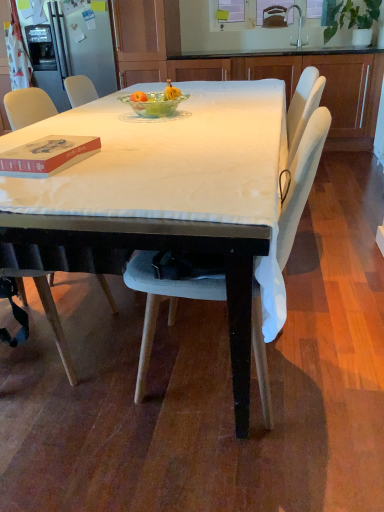
Find the location of a particular element. The height and width of the screenshot is (512, 384). unoccupied region to the right of translucent glass bowl at center is located at coordinates (225, 114).